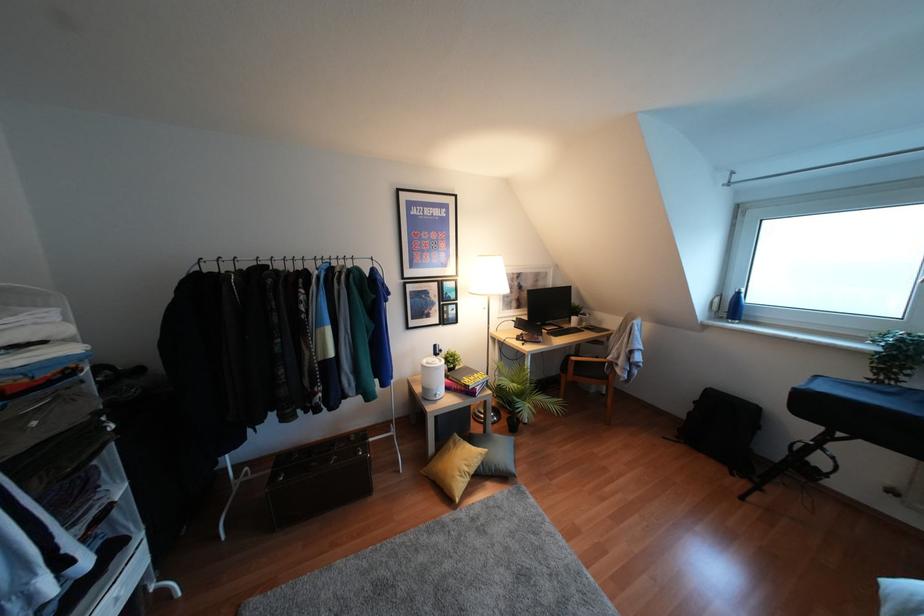
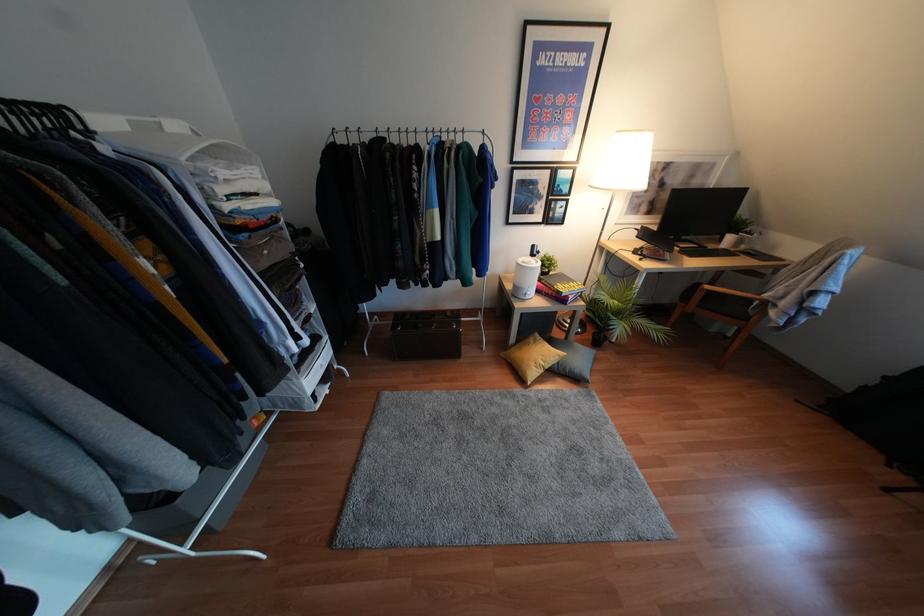
Where in the second image is the point corresponding to pixel 517 419 from the first image?

(604, 336)